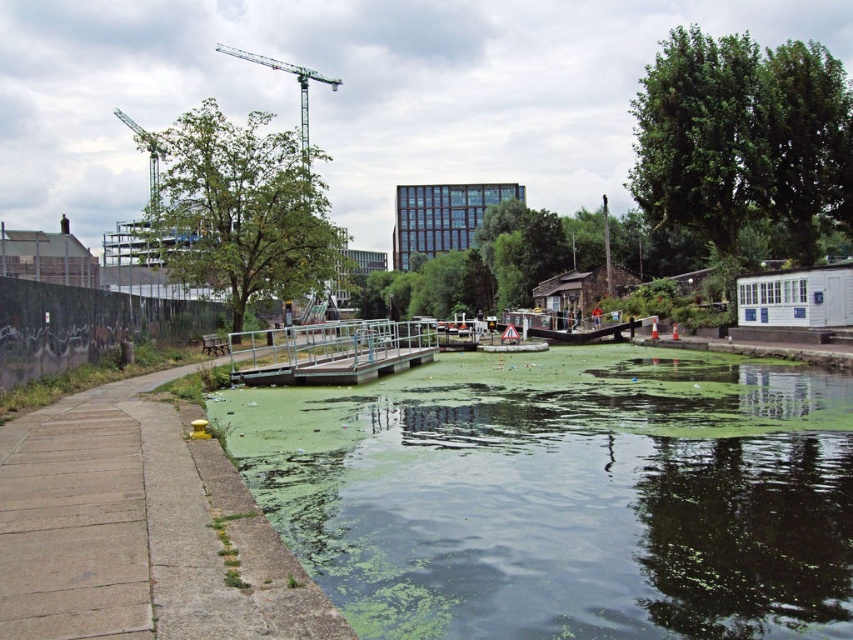
Which is behind, point (126, 520) or point (270, 340)?

The point (270, 340) is more distant.

This screenshot has height=640, width=853. What do you see at coordinates (138, 529) in the screenshot? I see `concrete at left` at bounding box center [138, 529].

Find the location of a particular element. This screenshot has height=640, width=853. concrete at left is located at coordinates (138, 529).

Based on the photo, which is below, concrete at left or green metallic crane at upper center?

concrete at left is below.

Find the location of a particular element. Image resolution: width=853 pixels, height=640 pixels. concrete at left is located at coordinates tap(138, 529).

Is point (622, 365) farther from viewer compared to point (245, 58)?

That is False.

Who is taller, green algae-covered water at center or green metallic crane at upper center?

green metallic crane at upper center

Describe the element at coordinates (564, 493) in the screenshot. I see `green algae-covered water at center` at that location.

Where is `green algae-covered water at center`? The height and width of the screenshot is (640, 853). green algae-covered water at center is located at coordinates (564, 493).